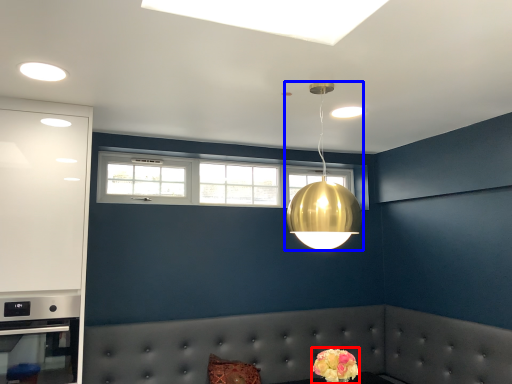
Question: Among these objects, which one is nearest to the camera, flower (highlighted by a red box) or lamp (highlighted by a blue box)?

Choices:
 (A) flower
 (B) lamp

Answer: (B)